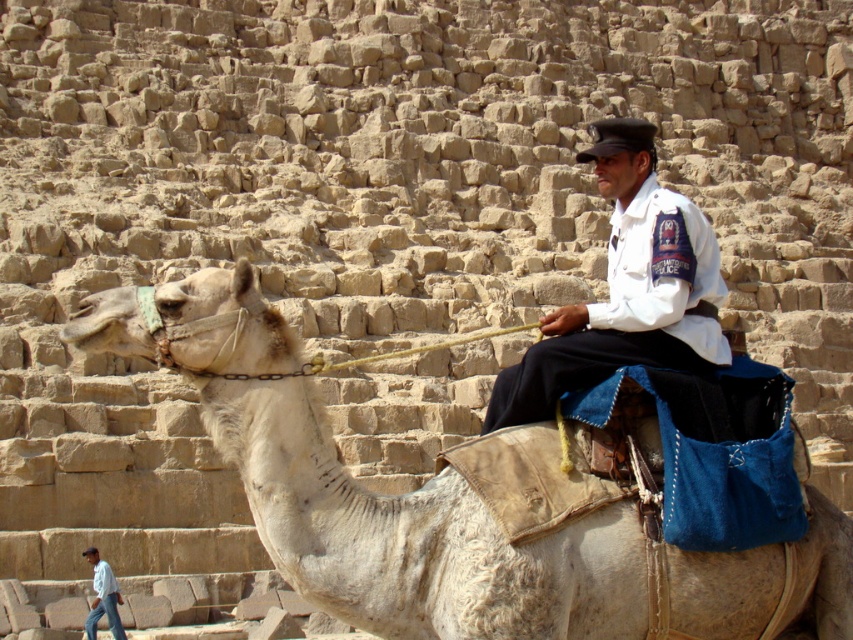
Can you confirm if white uniform at center is bigger than light blue shirt at lower left?

Indeed, white uniform at center has a larger size compared to light blue shirt at lower left.

Does white uniform at center have a smaller size compared to light blue shirt at lower left?

Actually, white uniform at center might be larger than light blue shirt at lower left.

Locate an element on the screen. The height and width of the screenshot is (640, 853). white uniform at center is located at coordinates (625, 289).

Does white textured camel at center have a larger size compared to white uniform at center?

Actually, white textured camel at center might be smaller than white uniform at center.

Describe the element at coordinates (367, 492) in the screenshot. I see `white textured camel at center` at that location.

Does point (355, 620) come farther from viewer compared to point (555, 387)?

No, (355, 620) is in front of (555, 387).

Find the location of `white textured camel at center`. white textured camel at center is located at coordinates (367, 492).

Based on the photo, can you confirm if white textured camel at center is positioned to the right of light blue shirt at lower left?

Indeed, white textured camel at center is positioned on the right side of light blue shirt at lower left.

Does white textured camel at center appear under light blue shirt at lower left?

Incorrect, white textured camel at center is not positioned below light blue shirt at lower left.

Is point (585, 536) positioned behind point (115, 611)?

That is False.

Locate an element on the screen. This screenshot has height=640, width=853. white textured camel at center is located at coordinates (367, 492).